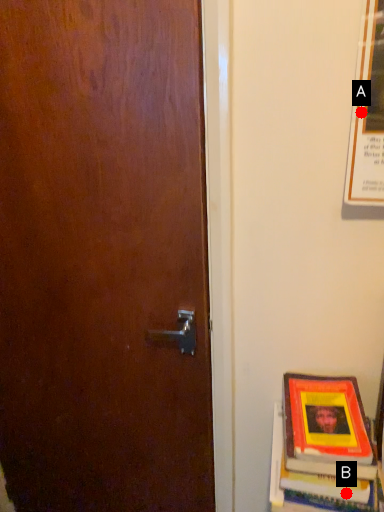
Question: Two points are circled on the image, labeled by A and B beside each circle. Which point is further to the camera?

Choices:
 (A) A is further
 (B) B is further

Answer: (B)